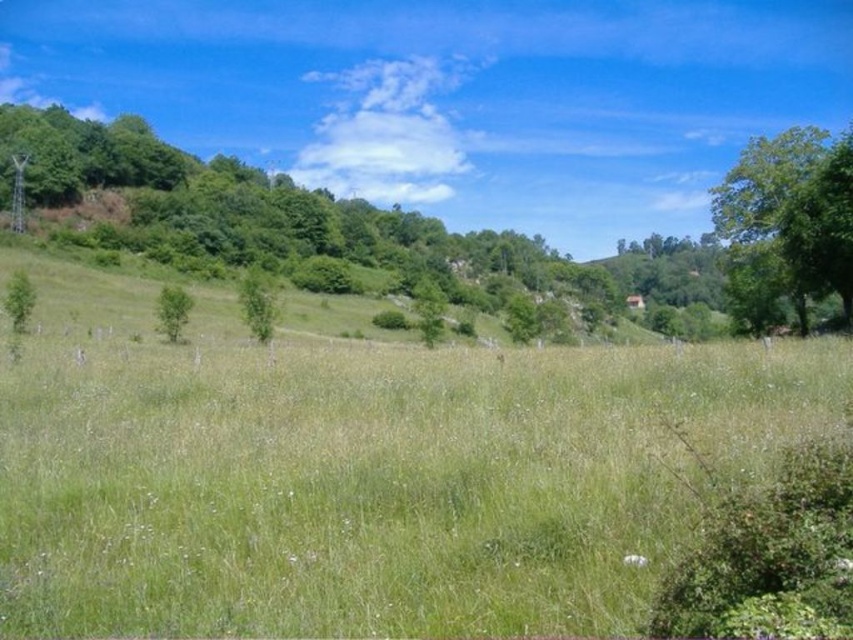
Question: Which point appears farthest from the camera in this image?

Choices:
 (A) (184, 300)
 (B) (740, 250)

Answer: (A)

Question: Among these objects, which one is nearest to the camera?

Choices:
 (A) green leafy tree at center
 (B) green leafy tree at right

Answer: (B)

Question: Which object is farther from the camera taking this photo?

Choices:
 (A) green leafy tree at center
 (B) green leafy tree at right

Answer: (A)

Question: Can you confirm if green leafy tree at right is thinner than green leafy tree at center?

Choices:
 (A) no
 (B) yes

Answer: (A)

Question: Does green leafy tree at right have a greater width compared to green leafy tree at center?

Choices:
 (A) no
 (B) yes

Answer: (B)

Question: Does green leafy tree at right have a larger size compared to green leafy tree at center?

Choices:
 (A) no
 (B) yes

Answer: (B)